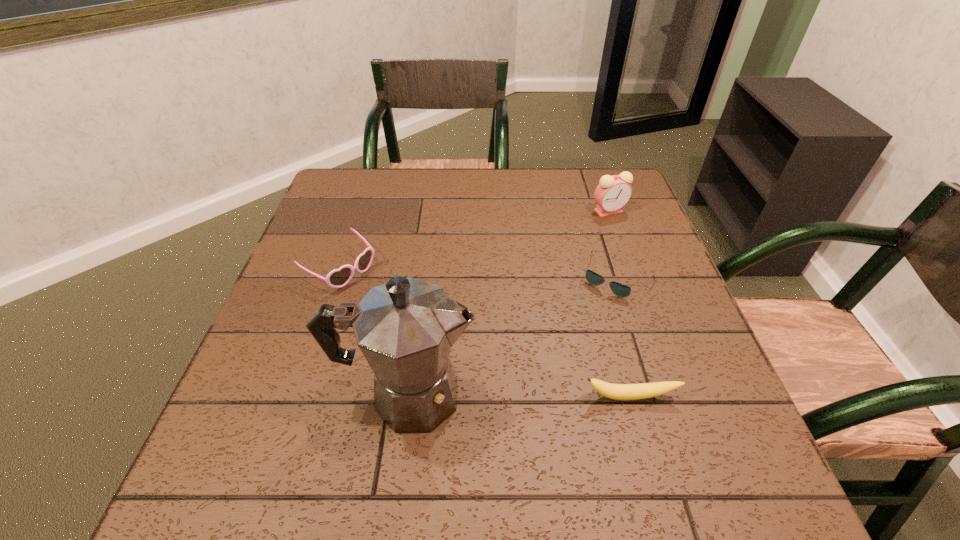
Locate an element on the screen. banana at the near edge is located at coordinates (644, 390).

The image size is (960, 540). In order to click on object present at the left edge in this screenshot , I will do `click(338, 278)`.

I want to click on banana located in the right edge section of the desktop, so click(x=644, y=390).

At what (x,y) coordinates should I click in order to perform the action: click on alarm clock that is at the right edge. Please return your answer as a coordinate pair (x, y). The height and width of the screenshot is (540, 960). Looking at the image, I should click on (613, 192).

Locate an element on the screen. sunglasses that is at the right edge is located at coordinates [x=620, y=290].

Find the location of a particular element. object positioned at the far right corner is located at coordinates (613, 192).

Locate an element on the screen. This screenshot has width=960, height=540. object located in the near right corner section of the desktop is located at coordinates point(644,390).

In the image, there is a desktop. Where is `vacant region at the far edge`? The width and height of the screenshot is (960, 540). vacant region at the far edge is located at coordinates (531, 213).

Find the location of a particular element. vacant space at the near edge of the desktop is located at coordinates (396, 433).

Locate an element on the screen. The image size is (960, 540). vacant space at the left edge of the desktop is located at coordinates (282, 349).